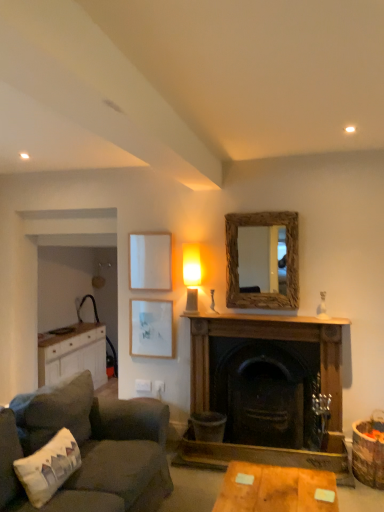
The height and width of the screenshot is (512, 384). I want to click on wooden table at lower center, so click(275, 489).

Where is `white wood cabinet at left`? white wood cabinet at left is located at coordinates (74, 355).

You are a GUI agent. You are given a task and a screenshot of the screen. Output one action in this format:
    pyautogui.click(x=<x>, y=<y>)
    Task: Click on the matte glass lamp at center
    The image size is (384, 512).
    Given the screenshot: What is the action you would take?
    pyautogui.click(x=191, y=275)

Describe the element at coordinates (118, 452) in the screenshot. I see `dark green fabric couch at lower left` at that location.

Measure the distance between point (9,468) and camera.

The depth of point (9,468) is 7.22 feet.

The height and width of the screenshot is (512, 384). What do you see at coordinates (262, 320) in the screenshot?
I see `wooden mantelpiece at center` at bounding box center [262, 320].

Locate an element on the screen. Image resolution: width=384 pixels, height=512 pixels. wooden table at lower center is located at coordinates (275, 489).

From the image's perspective, relative to wooden table at lower center, is matte glass lamp at center above or below?

matte glass lamp at center is situated higher than wooden table at lower center in the image.

Based on the photo, can you confirm if matte glass lamp at center is bigger than wooden table at lower center?

No, matte glass lamp at center is not bigger than wooden table at lower center.

From their relative heights in the image, would you say matte glass lamp at center is taller or shorter than wooden table at lower center?

Considering their sizes, matte glass lamp at center has more height than wooden table at lower center.

Which object is positioned more to the left, matte glass lamp at center or wooden table at lower center?

Positioned to the left is matte glass lamp at center.

From a real-world perspective, who is located lower, white matte picture frame at upper left, the 2th picture frame ordered from the bottom, or dark green fabric couch at lower left?

In real-world perspective, dark green fabric couch at lower left is lower.

Could you measure the distance between white matte picture frame at upper left, the 2th picture frame ordered from the bottom, and dark green fabric couch at lower left?

white matte picture frame at upper left, the 2th picture frame ordered from the bottom, is 4.80 feet away from dark green fabric couch at lower left.

From the image's perspective, which object appears higher, white matte picture frame at upper left, which ranks as the 1th picture frame in top-to-bottom order, or dark green fabric couch at lower left?

white matte picture frame at upper left, which ranks as the 1th picture frame in top-to-bottom order.

How many degrees apart are the facing directions of white matte picture frame at upper left, which ranks as the 1th picture frame in top-to-bottom order, and dark green fabric couch at lower left?

The facing directions of white matte picture frame at upper left, which ranks as the 1th picture frame in top-to-bottom order, and dark green fabric couch at lower left are 90 degrees apart.

How many degrees apart are the facing directions of matte glass lamp at center and dark green fabric couch at lower left?

The angle between the facing direction of matte glass lamp at center and the facing direction of dark green fabric couch at lower left is 90 degrees.

From the image's perspective, does matte glass lamp at center appear higher than dark green fabric couch at lower left?

Yes, from the image's perspective, matte glass lamp at center is on top of dark green fabric couch at lower left.

Is the surface of matte glass lamp at center in direct contact with dark green fabric couch at lower left?

No, matte glass lamp at center is not touching dark green fabric couch at lower left.

Is white fabric pillow at lower left oriented towards white wood cabinet at left?

No, white fabric pillow at lower left is not facing towards white wood cabinet at left.

Between white fabric pillow at lower left and white wood cabinet at left, which one appears on the right side from the viewer's perspective?

From the viewer's perspective, white fabric pillow at lower left appears more on the right side.

Is white fabric pillow at lower left in contact with white wood cabinet at left?

No, white fabric pillow at lower left is not with white wood cabinet at left.

Which of these two, wooden table at lower center or white fabric pillow at lower left, is bigger?

wooden table at lower center.

What's the angular difference between wooden table at lower center and white fabric pillow at lower left's facing directions?

0.0113 degrees separate the facing orientations of wooden table at lower center and white fabric pillow at lower left.

Considering their positions, is wooden table at lower center located in front of or behind white fabric pillow at lower left?

In the image, wooden table at lower center appears in front of white fabric pillow at lower left.

Does point (240, 477) lie behind point (69, 460)?

Yes, point (240, 477) is behind point (69, 460).

Is wooden fireplace at center located outside matte glass lamp at center?

Indeed, wooden fireplace at center is completely outside matte glass lamp at center.

Locate an element on the screen. Image resolution: width=384 pixels, height=512 pixels. lamp lying above the wooden fireplace at center (from the image's perspective) is located at coordinates (191, 275).

Is wooden fireplace at center taller than matte glass lamp at center?

Correct, wooden fireplace at center is much taller as matte glass lamp at center.

Is matte glass lamp at center at the back of wooden fireplace at center?

No, wooden fireplace at center is not facing away from matte glass lamp at center.

Between matte glass lamp at center and wooden fireplace at center, which one appears on the right side from the viewer's perspective?

wooden fireplace at center is more to the right.

From a real-world perspective, who is located lower, matte glass lamp at center or wooden fireplace at center?

wooden fireplace at center.

Is point (192, 277) closer or farther from the camera than point (205, 399)?

Point (192, 277).

How many degrees apart are the facing directions of matte glass lamp at center and wooden fireplace at center?

matte glass lamp at center and wooden fireplace at center are facing 0.0137 degrees away from each other.

Image resolution: width=384 pixels, height=512 pixels. Find the location of `table located in front of the matte glass lamp at center`. table located in front of the matte glass lamp at center is located at coordinates (275, 489).

Where is `studio couch located on the left of white matte picture frame at upper left, which ranks as the 1th picture frame in top-to-bottom order`? This screenshot has width=384, height=512. studio couch located on the left of white matte picture frame at upper left, which ranks as the 1th picture frame in top-to-bottom order is located at coordinates (118, 452).

Looking at the image, which one is located further to rustic wood mirror at upper center, matte white picture frame at upper left, which is the second picture frame from top to bottom, or wooden table at lower center?

wooden table at lower center is positioned further to the anchor rustic wood mirror at upper center.

Looking at the image, which one is located closer to wooden fireplace at center, rustic wood mirror at upper center or white wood cabinet at left?

rustic wood mirror at upper center.

Looking at the image, which one is located further to matte glass lamp at center, wooden fireplace at center or white wood cabinet at left?

white wood cabinet at left lies further to matte glass lamp at center than the other object.

When comparing their distances from rustic wood mirror at upper center, does white wood cabinet at left or dark green fabric couch at lower left seem further?

white wood cabinet at left.

When comparing their distances from wooden fireplace at center, does wooden table at lower center or matte glass lamp at center seem closer?

matte glass lamp at center is closer to wooden fireplace at center.

Based on the photo, when comparing their distances from wooden table at lower center, does dark green fabric couch at lower left or matte white picture frame at upper left, which is the second picture frame from top to bottom, seem closer?

Based on the image, dark green fabric couch at lower left appears to be nearer to wooden table at lower center.

Looking at the image, which one is located further to white wood cabinet at left, matte glass lamp at center or rustic wood mirror at upper center?

Based on the image, rustic wood mirror at upper center appears to be further to white wood cabinet at left.

Which object lies further to the anchor point white fabric pillow at lower left, matte white picture frame at upper left, which is the second picture frame from top to bottom, or rustic wood mirror at upper center?

rustic wood mirror at upper center is further to white fabric pillow at lower left.

You are a GUI agent. You are given a task and a screenshot of the screen. Output one action in this format:
    pyautogui.click(x=<x>, y=<y>)
    Task: Click on the lamp between white matte picture frame at upper left, which ranks as the 1th picture frame in top-to-bottom order, and matte white picture frame at upper left, which appears as the 1th picture frame when ordered from the bottom, in the vertical direction
    This screenshot has width=384, height=512.
    Given the screenshot: What is the action you would take?
    pyautogui.click(x=191, y=275)

In order to click on mantle between wooden table at lower center and white matte picture frame at upper left, the 2th picture frame ordered from the bottom, from front to back in this screenshot , I will do `click(262, 320)`.

Locate an element on the screen. This screenshot has height=512, width=384. picture frame located between white matte picture frame at upper left, the 2th picture frame ordered from the bottom, and rustic wood mirror at upper center in the left-right direction is located at coordinates (151, 328).

I want to click on mantle positioned between dark green fabric couch at lower left and matte glass lamp at center from near to far, so click(x=262, y=320).